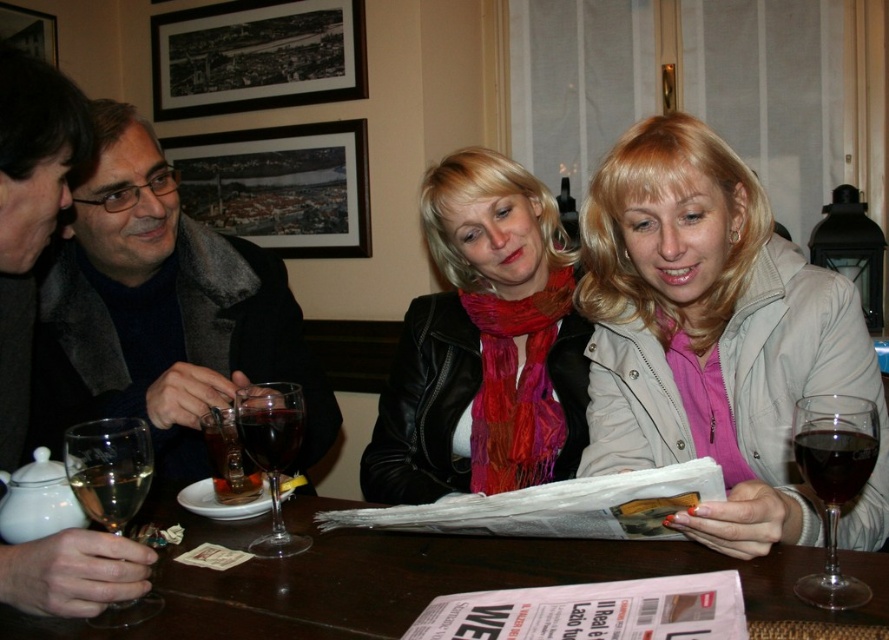
You are a waiter in a restaurant and need to serve drinks to the two women seated in the middle ground. The transparent glass at center is for the woman in the black leather jacket, and the dark red glass at lower right is for the woman next to her. Which glass should you use to serve the woman with the red scarf?

The transparent glass at center should be used to serve the woman with the red scarf because it is bigger than the dark red glass at lower right, which is for the other woman.

You are a photographer adjusting your camera to focus on two points in the image. The first point is at coordinates point (135,433) and the second is at point (229,432). Which point should you focus on first if you want to start with the one closer to the camera?

You should focus on point (135,433) first because it is closer to the camera than point (229,432).

Which object is wider, the dark gray wool coat at left or the dark red glass at lower right?

The dark gray wool coat at left is wider than the dark red glass at lower right according to the description.